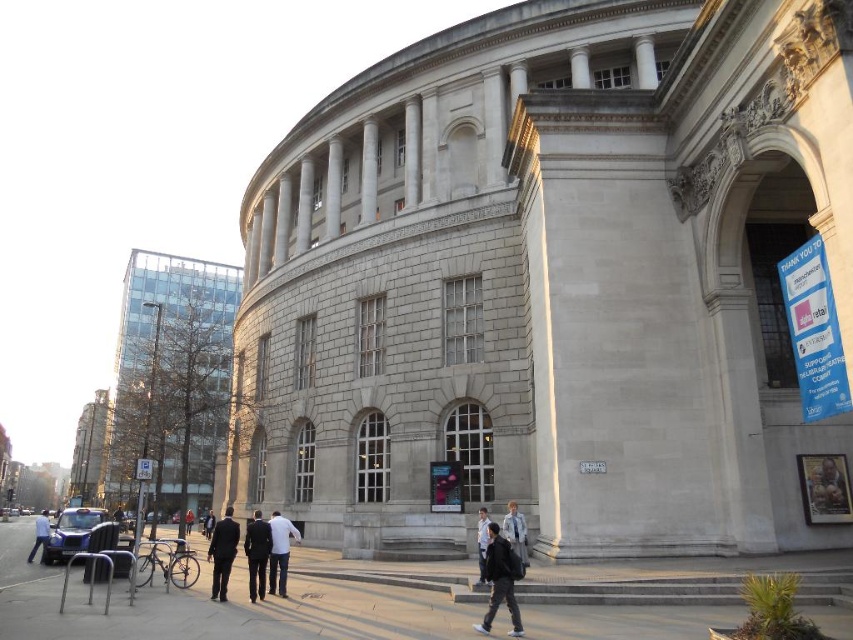
You are standing in front of the classical building and see the dark blue jeans at lower left and the red fabric jacket at center. Which object is positioned more to the left side of the scene?

The dark blue jeans at lower left is positioned more to the left than the red fabric jacket at center, as it is located to the left of the jacket.

You are standing in front of the grand classical building and see two people dressed in a dark suit at center and a light blue fabric jacket at center. Which person is closer to you?

The dark suit at center is closer to you because it is further to the viewer than the light blue fabric jacket at center.